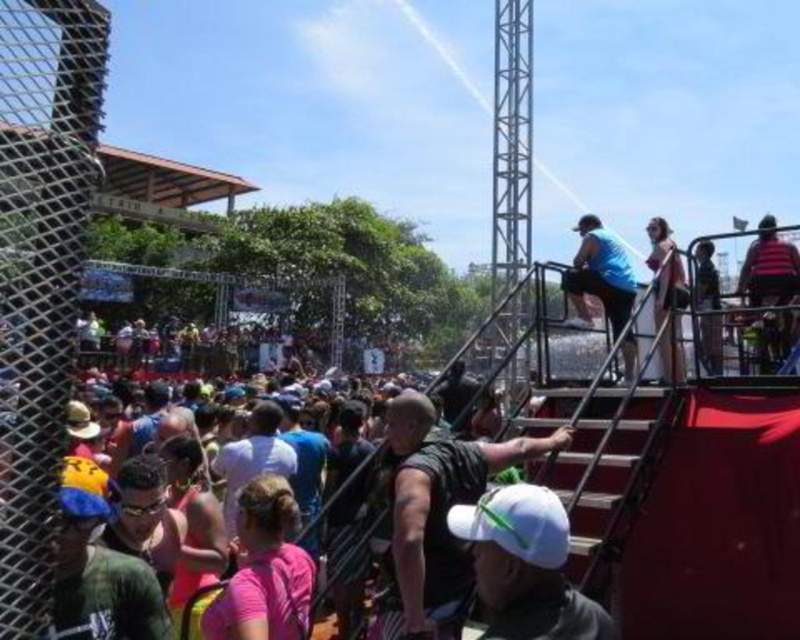
You are a photographer at the event and want to capture both the pink fabric shirt at center and the blue matte shirt at upper right in a single frame. Which shirt should you focus on to ensure both are visible without cropping?

The pink fabric shirt at center occupies less space than the blue matte shirt at upper right, so focusing on the blue matte shirt at upper right would allow both to be visible as the larger shirt provides more room for composition.

You are a photographer at the event and want to capture both the pink fabric shirt at center and the dark blue shirt at upper right in a single frame. Which shirt should you focus on to ensure both are in the frame without zooming in or out?

The pink fabric shirt at center is smaller in size than the dark blue shirt at upper right, so focusing on the dark blue shirt at upper right would allow both shirts to fit within the frame without needing to adjust the zoom.

You are a photographer at the event and want to capture both the blue matte shirt at upper right and the striped fabric shirt at upper right in the same frame. Which shirt should you adjust your camera to focus on first to ensure both are in the shot?

The blue matte shirt at upper right is positioned on the left side of striped fabric shirt at upper right. To capture both in the same frame, focus on the blue matte shirt at upper right first as it is closer to the left edge, allowing the striped fabric shirt at upper right to naturally fall into the right side of the frame.